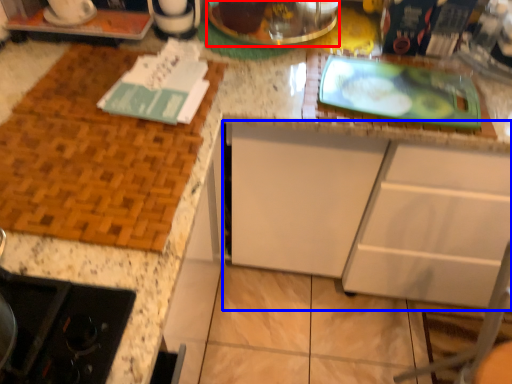
Question: Which object is further to the camera taking this photo, appliance (highlighted by a red box) or cabinetry (highlighted by a blue box)?

Choices:
 (A) appliance
 (B) cabinetry

Answer: (A)